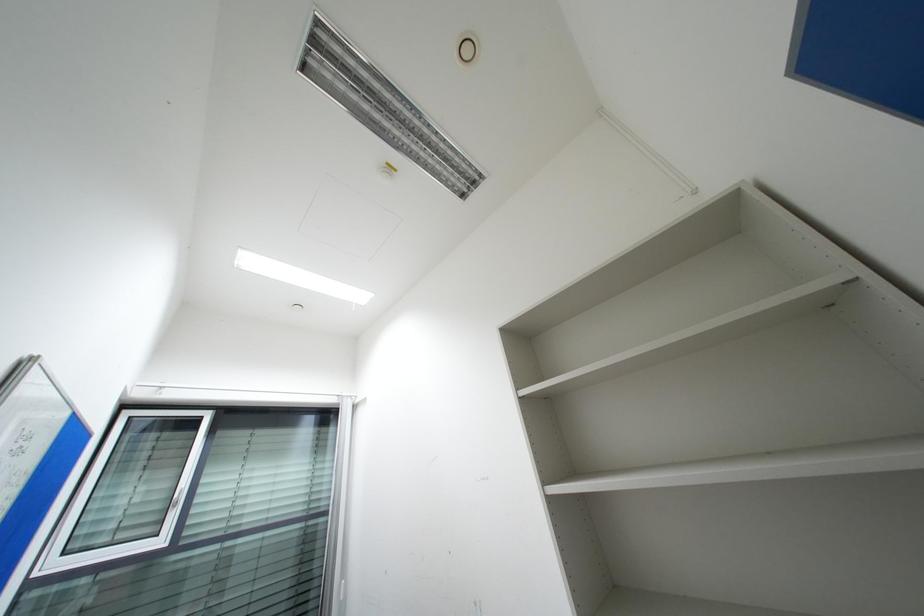
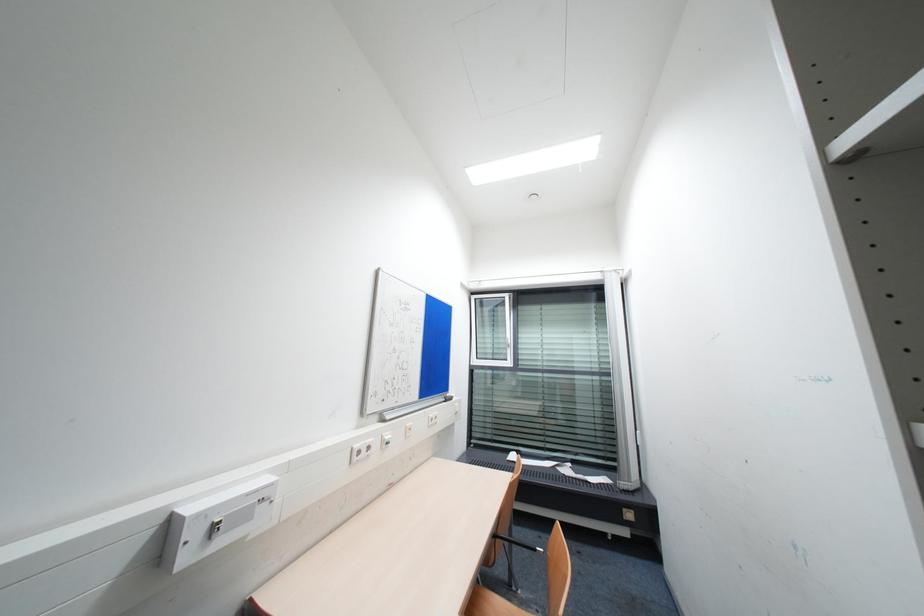
Question: Based on the continuous images, in which direction is the camera rotating? Reply with the corresponding letter.

Choices:
 (A) Left
 (B) Right
 (C) Up
 (D) Down

Answer: (A)